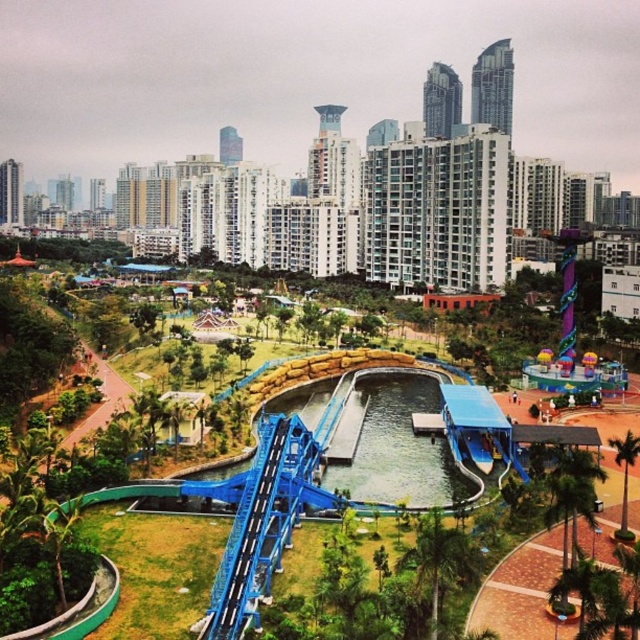
Question: Is green leafy palm tree at center to the left of green leafy palm tree at lower right from the viewer's perspective?

Choices:
 (A) no
 (B) yes

Answer: (B)

Question: Does blue glossy water slide at center have a smaller size compared to green leafy palm tree at center?

Choices:
 (A) no
 (B) yes

Answer: (A)

Question: Considering the real-world distances, which object is closest to the green leafy palm tree at lower right?

Choices:
 (A) green leafy palm tree at center
 (B) blue glossy water slide at center

Answer: (A)

Question: Which of the following is the closest to the observer?

Choices:
 (A) green leafy palm tree at lower right
 (B) blue glossy water slide at center

Answer: (B)

Question: Which point appears closest to the camera in this image?

Choices:
 (A) (614, 444)
 (B) (244, 552)
 (C) (456, 576)

Answer: (C)

Question: Can you confirm if blue glossy water slide at center is positioned below green leafy palm tree at lower right?

Choices:
 (A) no
 (B) yes

Answer: (A)